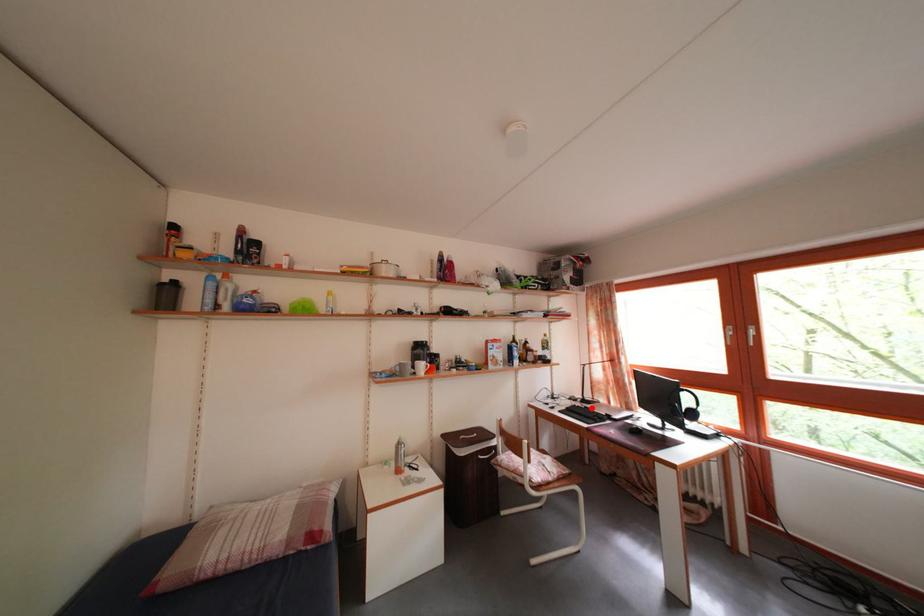
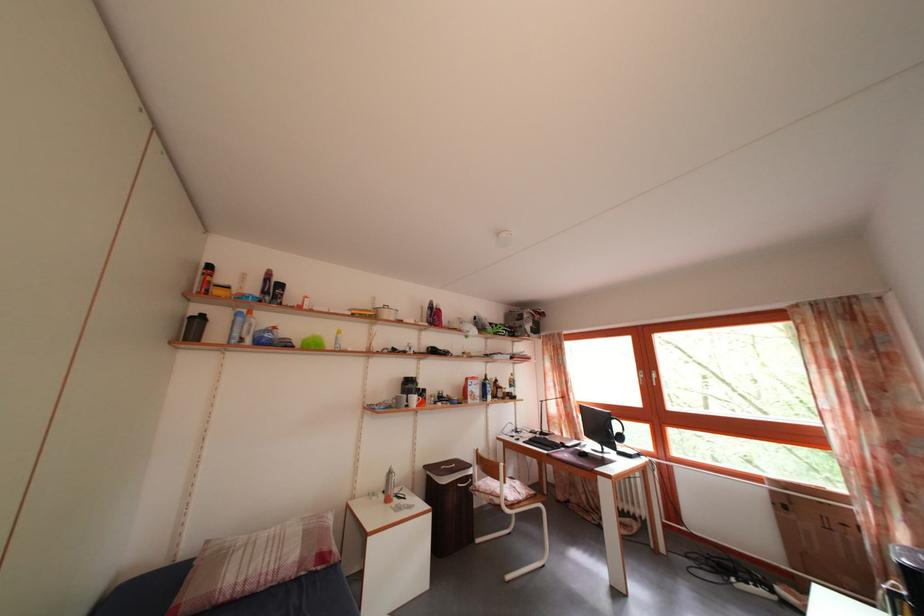
Find the pixel in the second image that matches the highlighted location in the first image.

(550, 440)